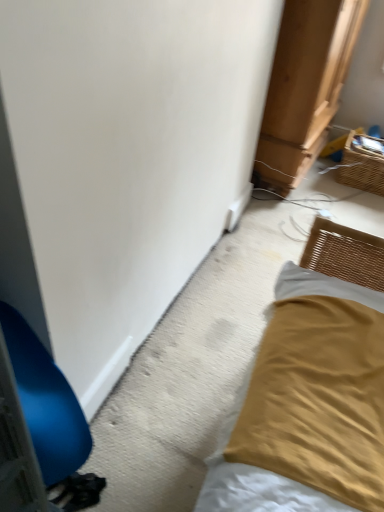
Describe the element at coordinates (45, 402) in the screenshot. The width and height of the screenshot is (384, 512). I see `blue plastic chair at left` at that location.

You are a GUI agent. You are given a task and a screenshot of the screen. Output one action in this format:
    pyautogui.click(x=<x>, y=<y>)
    Task: Click on the blue plastic chair at left
    The height and width of the screenshot is (512, 384).
    Given the screenshot: What is the action you would take?
    pyautogui.click(x=45, y=402)

I want to click on woven brown basket at upper right, so click(362, 164).

The height and width of the screenshot is (512, 384). What do you see at coordinates (362, 164) in the screenshot?
I see `woven brown basket at upper right` at bounding box center [362, 164].

In order to face woven brown basket at upper right, should I rotate leftwards or rightwards?

You should rotate right by 22.498 degrees.

The width and height of the screenshot is (384, 512). Identify the location of blue plastic chair at left. (45, 402).

Which object is positioned more to the right, blue plastic chair at left or woven brown basket at upper right?

woven brown basket at upper right.

Considering their positions, is blue plastic chair at left located in front of or behind woven brown basket at upper right?

blue plastic chair at left is positioned closer to the viewer than woven brown basket at upper right.

Is point (45, 468) closer or farther from the camera than point (348, 175)?

Point (45, 468).

From the image's perspective, who appears lower, blue plastic chair at left or woven brown basket at upper right?

From the image's view, blue plastic chair at left is below.

From the picture: From a real-world perspective, is blue plastic chair at left beneath woven brown basket at upper right?

No, from a real-world perspective, blue plastic chair at left is not under woven brown basket at upper right.

Is blue plastic chair at left thinner than woven brown basket at upper right?

Incorrect, the width of blue plastic chair at left is not less than that of woven brown basket at upper right.

Does blue plastic chair at left have a lesser height compared to woven brown basket at upper right?

No, blue plastic chair at left is not shorter than woven brown basket at upper right.

Looking at the image, does blue plastic chair at left seem bigger or smaller compared to woven brown basket at upper right?

Clearly, blue plastic chair at left is larger in size than woven brown basket at upper right.

Would you say blue plastic chair at left contains woven brown basket at upper right?

No, blue plastic chair at left does not contain woven brown basket at upper right.

In the scene shown: Is blue plastic chair at left not near woven brown basket at upper right?

Yes, blue plastic chair at left is far from woven brown basket at upper right.

Could you tell me if blue plastic chair at left is turned towards woven brown basket at upper right?

No, blue plastic chair at left is not facing towards woven brown basket at upper right.

Based on the photo, how many degrees apart are the facing directions of blue plastic chair at left and woven brown basket at upper right?

The facing directions of blue plastic chair at left and woven brown basket at upper right are 88.5 degrees apart.

This screenshot has height=512, width=384. Identify the location of basket behind the blue plastic chair at left. (362, 164).

Is woven brown basket at upper right at the right side of blue plastic chair at left?

Yes, woven brown basket at upper right is to the right of blue plastic chair at left.

In the scene shown: Which is behind, woven brown basket at upper right or blue plastic chair at left?

woven brown basket at upper right is further from the camera.

Considering the points (379, 160) and (59, 423), which point is in front, point (379, 160) or point (59, 423)?

The point (59, 423) is in front.

From the image's perspective, between woven brown basket at upper right and blue plastic chair at left, who is located below?

From the image's view, blue plastic chair at left is below.

From a real-world perspective, between woven brown basket at upper right and blue plastic chair at left, who is vertically lower?

From a 3D spatial view, woven brown basket at upper right is below.

Is woven brown basket at upper right wider or thinner than blue plastic chair at left?

Clearly, woven brown basket at upper right has less width compared to blue plastic chair at left.

Can you confirm if woven brown basket at upper right is taller than blue plastic chair at left?

In fact, woven brown basket at upper right may be shorter than blue plastic chair at left.

Between woven brown basket at upper right and blue plastic chair at left, which one has smaller size?

Smaller between the two is woven brown basket at upper right.

Is woven brown basket at upper right inside or outside of blue plastic chair at left?

woven brown basket at upper right lies outside blue plastic chair at left.

Are woven brown basket at upper right and blue plastic chair at left far apart?

That's right, there is a large distance between woven brown basket at upper right and blue plastic chair at left.

Is woven brown basket at upper right oriented away from blue plastic chair at left?

woven brown basket at upper right is not turned away from blue plastic chair at left.

How different are the orientations of woven brown basket at upper right and blue plastic chair at left in degrees?

woven brown basket at upper right and blue plastic chair at left are facing 88.5 degrees away from each other.

How distant is woven brown basket at upper right from blue plastic chair at left?

They are 2.54 meters apart.

What are the coordinates of `basket behind the blue plastic chair at left` in the screenshot? It's located at (362, 164).

This screenshot has width=384, height=512. What are the coordinates of `basket behind the blue plastic chair at left` in the screenshot? It's located at (362, 164).

Find the location of `furniture that is below the woven brown basket at upper right (from the image's perspective)`. furniture that is below the woven brown basket at upper right (from the image's perspective) is located at coordinates (45, 402).